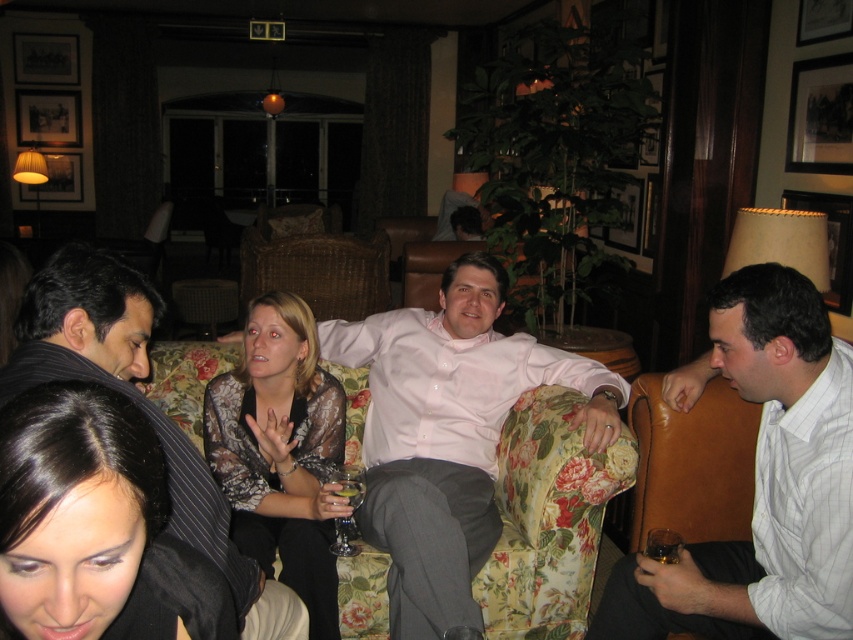
Does white striped shirt at right have a larger size compared to translucent glass at lower right?

Yes.

Between white striped shirt at right and translucent glass at lower right, which one is positioned higher?

white striped shirt at right is higher up.

Is point (757, 310) closer to camera compared to point (676, 538)?

Yes, it is in front of point (676, 538).

At what (x,y) coordinates should I click in order to perform the action: click on white striped shirt at right. Please return your answer as a coordinate pair (x, y). This screenshot has height=640, width=853. Looking at the image, I should click on pyautogui.click(x=759, y=481).

What are the coordinates of `white striped shirt at right` in the screenshot? It's located at (759, 481).

Looking at this image, which of these two, white striped shirt at right or printed silk blouse at center, stands taller?

printed silk blouse at center is taller.

Which is behind, point (779, 296) or point (265, 500)?

The point (265, 500) is behind.

In order to click on white striped shirt at right in this screenshot , I will do `click(759, 481)`.

Does clear glass wine glass at lower center have a lesser height compared to translucent glass at lower center?

In fact, clear glass wine glass at lower center may be taller than translucent glass at lower center.

Who is positioned more to the left, clear glass wine glass at lower center or translucent glass at lower center?

clear glass wine glass at lower center is more to the left.

Does point (332, 548) come closer to viewer compared to point (341, 490)?

Yes, it is.

This screenshot has height=640, width=853. Find the location of `clear glass wine glass at lower center`. clear glass wine glass at lower center is located at coordinates (349, 483).